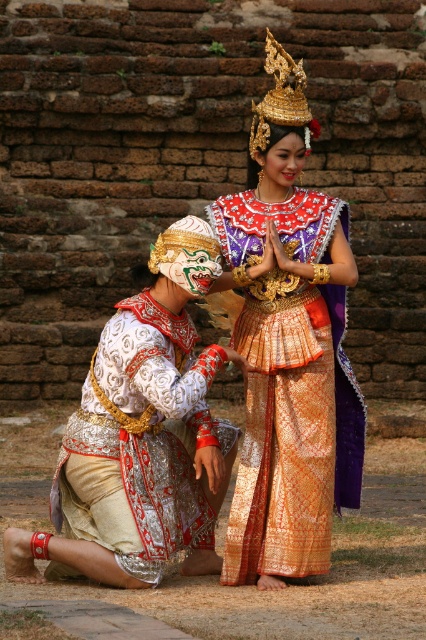
From the picture: Is gold brocade dress at center smaller than white embroidered fabric at lower left?

No.

Can you confirm if gold brocade dress at center is shorter than white embroidered fabric at lower left?

No, gold brocade dress at center is not shorter than white embroidered fabric at lower left.

Is point (227, 220) positioned after point (109, 496)?

Yes, point (227, 220) is farther from viewer.

Find the location of a particular element. gold brocade dress at center is located at coordinates (290, 349).